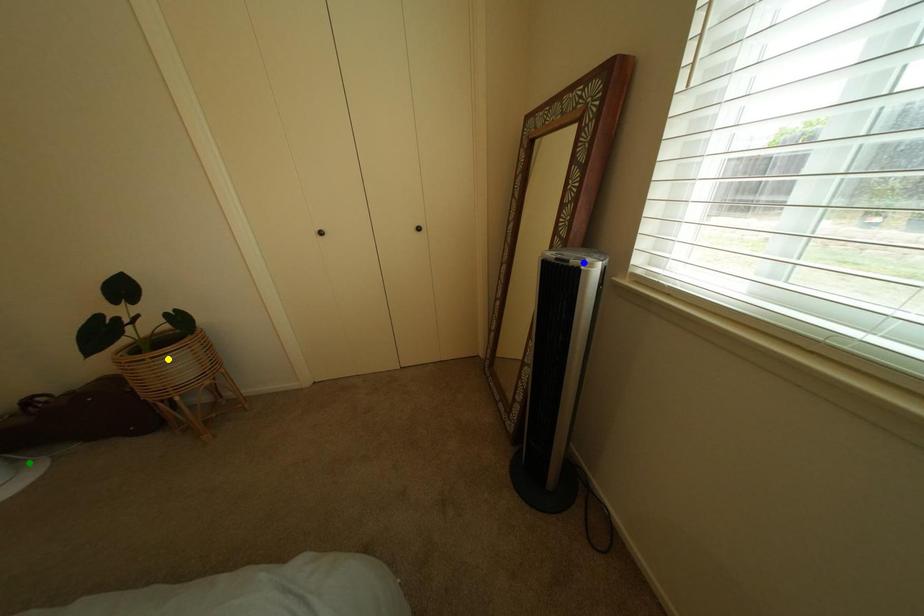
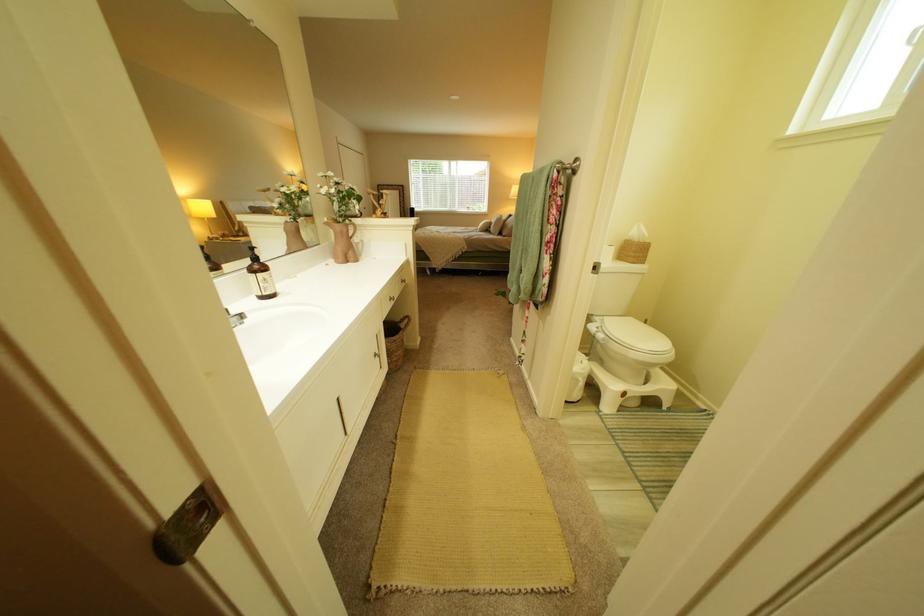
I am providing you with two images of the same scene from different viewpoints. Three points are marked in image1. Which point corresponds to a part or object that is occluded in image2?In image1, three points are marked. Which of them correspond to a part or object that is occluded in image2?Among the three points shown in image1, which one corresponds to a part or object that is no longer visible due to occlusion in image2?

green point, blue point, yellow point